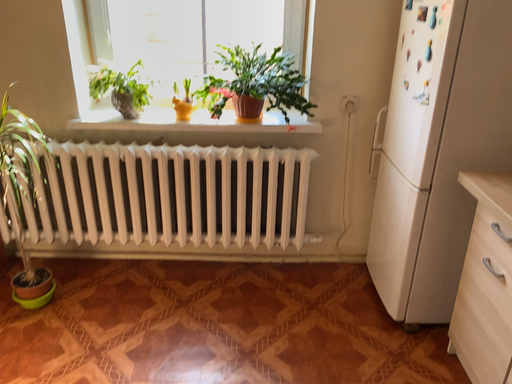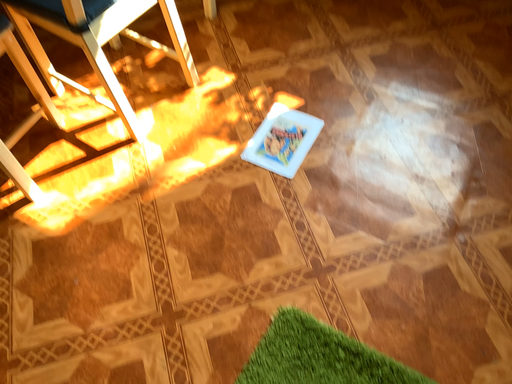
Question: How did the camera likely rotate when shooting the video?

Choices:
 (A) rotated left
 (B) rotated right

Answer: (A)